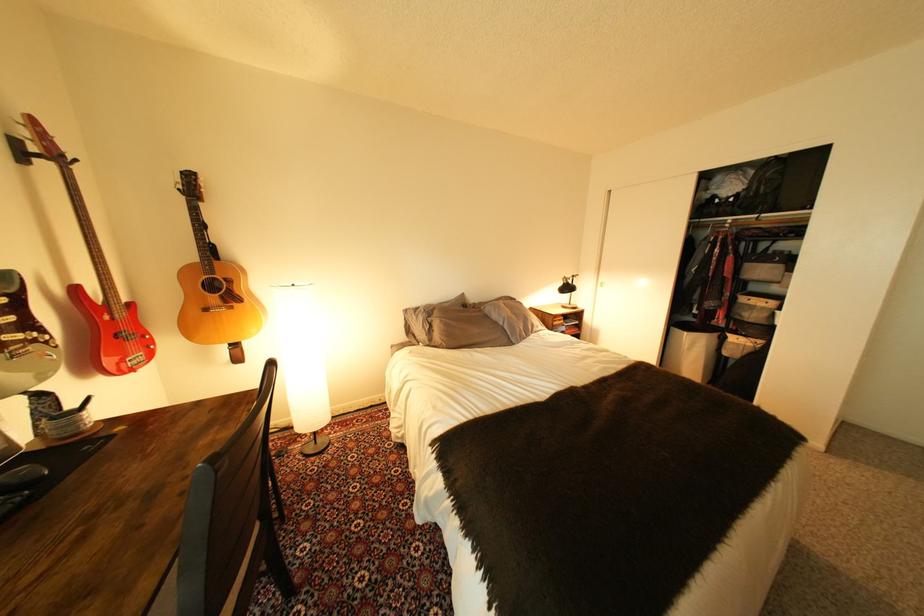
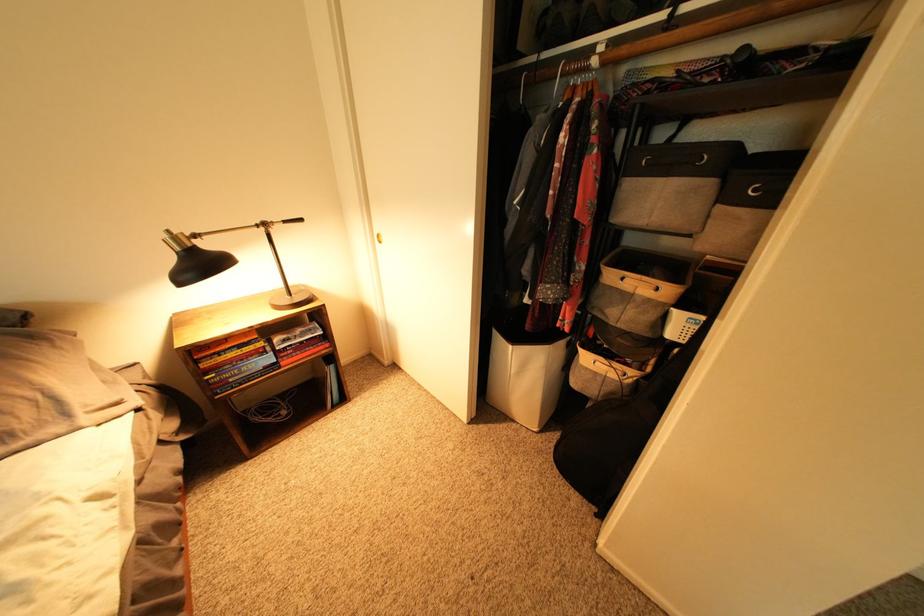
What movement of the cameraman would produce the second image?

The cameraman walked toward right, forward.